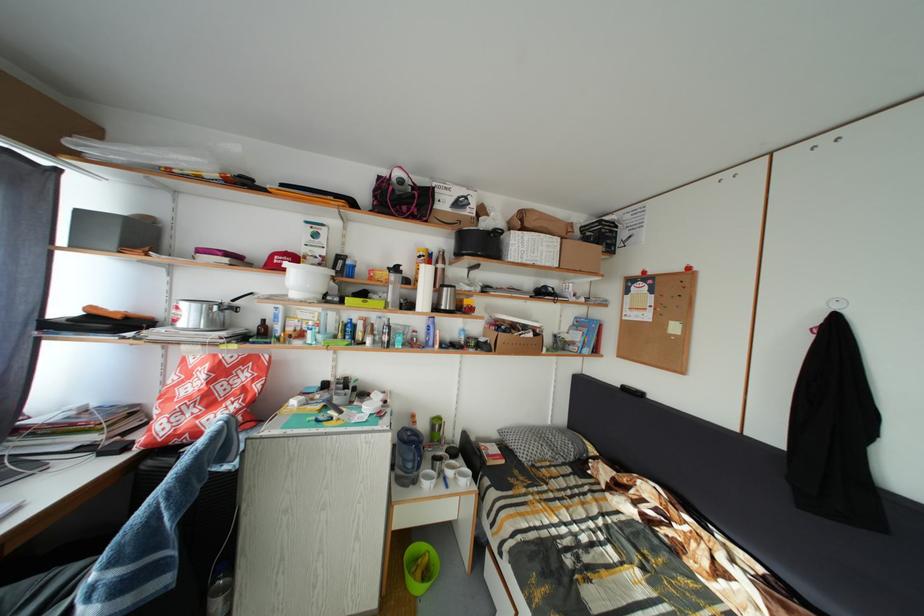
Image resolution: width=924 pixels, height=616 pixels. Describe the element at coordinates (419, 456) in the screenshot. I see `a blue kettle handle` at that location.